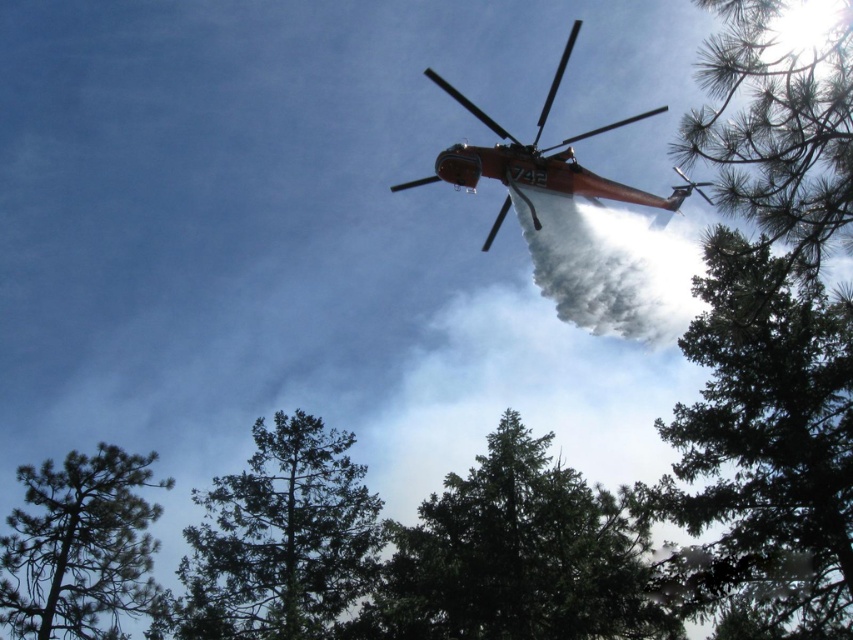
Question: Does green leafy tree at upper right have a lesser width compared to metallic orange helicopter at upper center?

Choices:
 (A) no
 (B) yes

Answer: (B)

Question: Which point is farther to the camera?

Choices:
 (A) green textured pine tree at upper right
 (B) green textured tree at center
 (C) dark green textured tree at center
 (D) green leafy tree at upper right

Answer: (B)

Question: Estimate the real-world distances between objects in this image. Which object is farther from the dark green textured tree at center?

Choices:
 (A) green leafy tree at upper right
 (B) green textured tree at center
 (C) metallic orange helicopter at upper center

Answer: (C)

Question: Is dark green textured tree at center to the right of green matte tree at lower left from the viewer's perspective?

Choices:
 (A) no
 (B) yes

Answer: (B)

Question: Does green textured pine tree at upper right come behind metallic orange helicopter at upper center?

Choices:
 (A) yes
 (B) no

Answer: (B)

Question: Estimate the real-world distances between objects in this image. Which object is farther from the green matte tree at lower left?

Choices:
 (A) green leafy tree at upper right
 (B) green textured pine tree at upper right
 (C) metallic orange helicopter at upper center

Answer: (B)